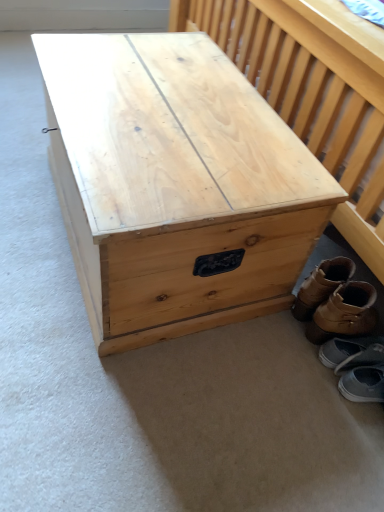
Question: Is brown leather boots at lower right, which ranks as the 4th footwear in bottom-to-top order, directly adjacent to gray suede shoes at lower right, arranged as the fourth footwear when viewed from the top?

Choices:
 (A) yes
 (B) no

Answer: (B)

Question: Is brown leather boots at lower right, the 1th footwear viewed from the top, facing towards gray suede shoes at lower right, placed as the 1th footwear when sorted from bottom to top?

Choices:
 (A) yes
 (B) no

Answer: (B)

Question: Considering the relative sizes of brown leather boots at lower right, which ranks as the 4th footwear in bottom-to-top order, and gray suede shoes at lower right, placed as the 1th footwear when sorted from bottom to top, in the image provided, is brown leather boots at lower right, which ranks as the 4th footwear in bottom-to-top order, taller than gray suede shoes at lower right, placed as the 1th footwear when sorted from bottom to top,?

Choices:
 (A) no
 (B) yes

Answer: (B)

Question: Does brown leather boots at lower right, the 1th footwear viewed from the top, have a lesser width compared to gray suede shoes at lower right, placed as the 1th footwear when sorted from bottom to top?

Choices:
 (A) yes
 (B) no

Answer: (A)

Question: Is brown leather boots at lower right, which ranks as the 4th footwear in bottom-to-top order, closer to camera compared to gray suede shoes at lower right, placed as the 1th footwear when sorted from bottom to top?

Choices:
 (A) yes
 (B) no

Answer: (B)

Question: From a real-world perspective, is brown leather boots at lower right, the 1th footwear viewed from the top, located higher than gray suede shoes at lower right, arranged as the fourth footwear when viewed from the top?

Choices:
 (A) yes
 (B) no

Answer: (A)

Question: From a real-world perspective, is natural wood trunk at center positioned under gray suede shoes at lower right, arranged as the fourth footwear when viewed from the top, based on gravity?

Choices:
 (A) no
 (B) yes

Answer: (A)

Question: Is gray suede shoes at lower right, arranged as the fourth footwear when viewed from the top, located within natural wood trunk at center?

Choices:
 (A) yes
 (B) no

Answer: (B)

Question: Can you confirm if natural wood trunk at center is shorter than gray suede shoes at lower right, arranged as the fourth footwear when viewed from the top?

Choices:
 (A) yes
 (B) no

Answer: (B)

Question: Is natural wood trunk at center facing away from gray suede shoes at lower right, arranged as the fourth footwear when viewed from the top?

Choices:
 (A) yes
 (B) no

Answer: (B)

Question: Does natural wood trunk at center come in front of gray suede shoes at lower right, arranged as the fourth footwear when viewed from the top?

Choices:
 (A) yes
 (B) no

Answer: (A)

Question: From the image's perspective, would you say natural wood trunk at center is positioned over gray suede shoes at lower right, arranged as the fourth footwear when viewed from the top?

Choices:
 (A) yes
 (B) no

Answer: (A)

Question: From the image's perspective, is brown leather boots at lower right, which ranks as the 4th footwear in bottom-to-top order, beneath natural wood trunk at center?

Choices:
 (A) no
 (B) yes

Answer: (B)